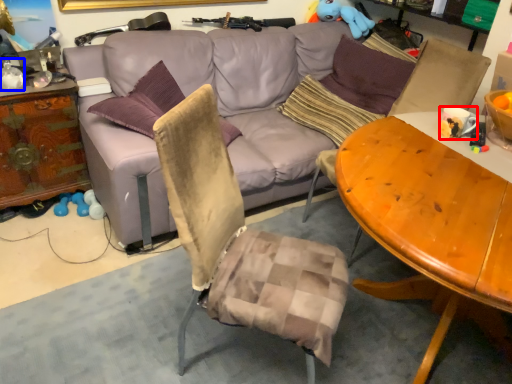
Question: Among these objects, which one is farthest to the camera, coffee cup (highlighted by a red box) or bottle (highlighted by a blue box)?

Choices:
 (A) coffee cup
 (B) bottle

Answer: (B)